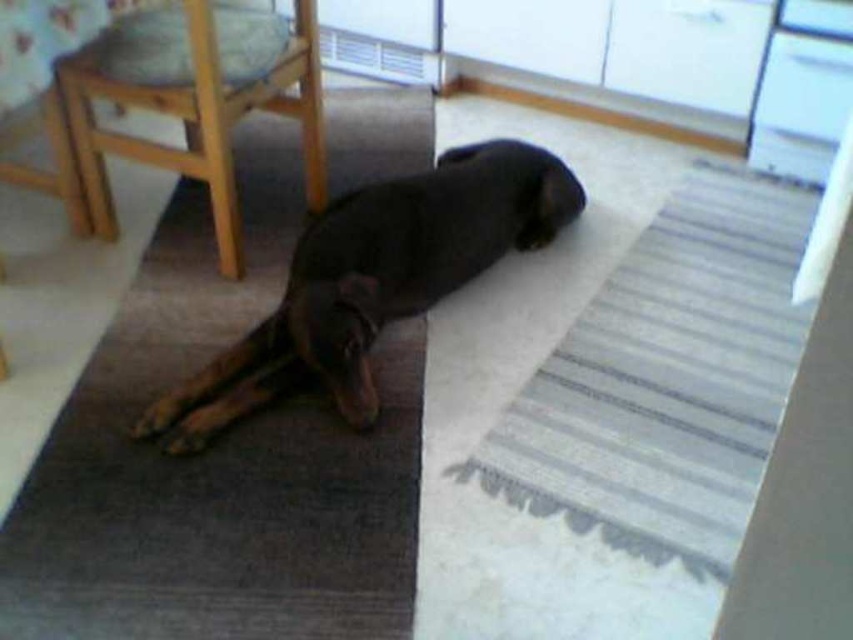
Question: Among these objects, which one is farthest from the camera?

Choices:
 (A) striped fabric mat at center
 (B) wooden chair at left

Answer: (B)

Question: In this image, where is black glossy dog at center located relative to wooden chair at left?

Choices:
 (A) right
 (B) left

Answer: (A)

Question: Is striped fabric mat at center smaller than black glossy dog at center?

Choices:
 (A) yes
 (B) no

Answer: (B)

Question: Which object is the closest to the striped fabric mat at center?

Choices:
 (A) wooden chair at left
 (B) black glossy dog at center

Answer: (B)

Question: Estimate the real-world distances between objects in this image. Which object is farther from the wooden chair at left?

Choices:
 (A) striped fabric mat at center
 (B) black glossy dog at center

Answer: (A)

Question: In this image, where is striped fabric mat at center located relative to wooden chair at left?

Choices:
 (A) below
 (B) above

Answer: (A)